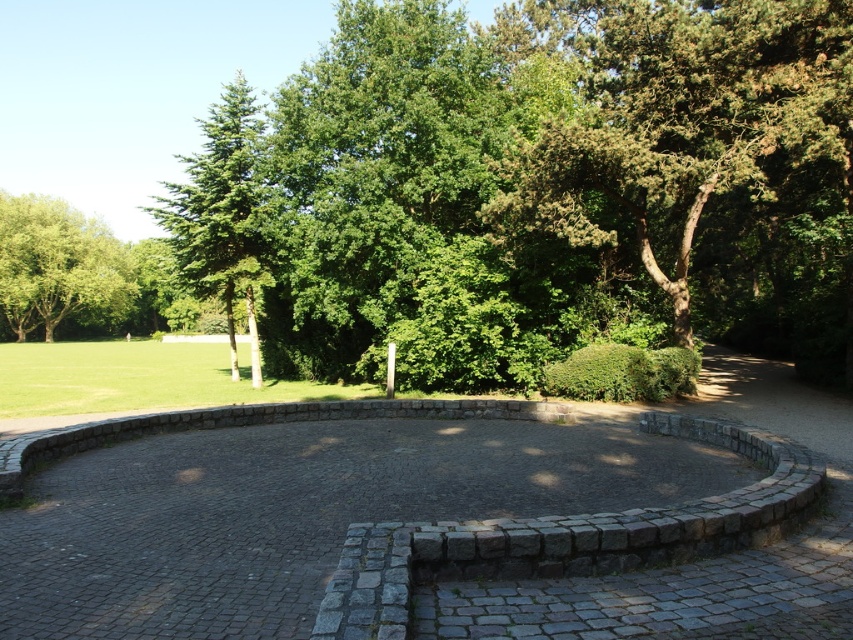
You are standing at the center of the circular paved area and want to walk towards the green leafy tree at upper left and the green leafy tree at left. Which tree will appear closer to you when you look ahead?

The green leafy tree at upper left will appear closer to you because it is positioned in front of the green leafy tree at left.